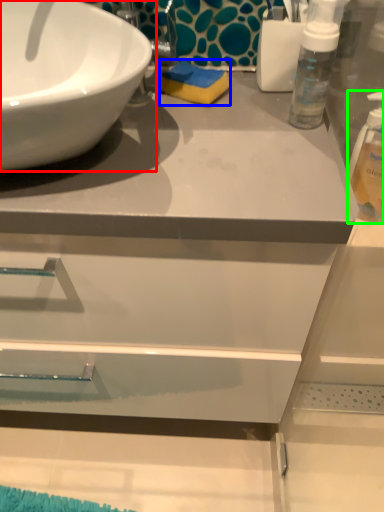
Question: Estimate the real-world distances between objects in this image. Which object is closer to sink (highlighted by a red box), soap (highlighted by a blue box) or cleaning product (highlighted by a green box)?

Choices:
 (A) soap
 (B) cleaning product

Answer: (A)